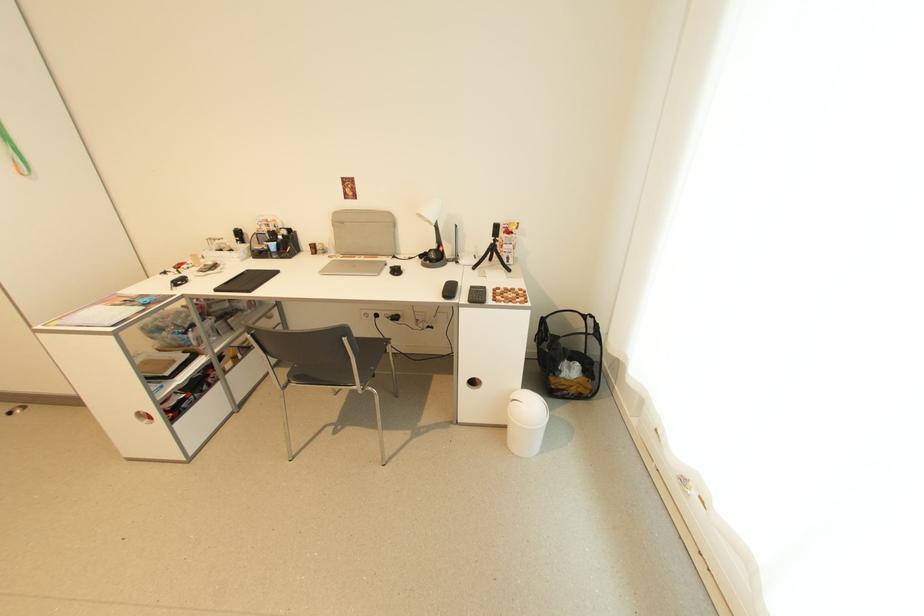
Which object does [492,249] point to?

It refers to a small black tripod.